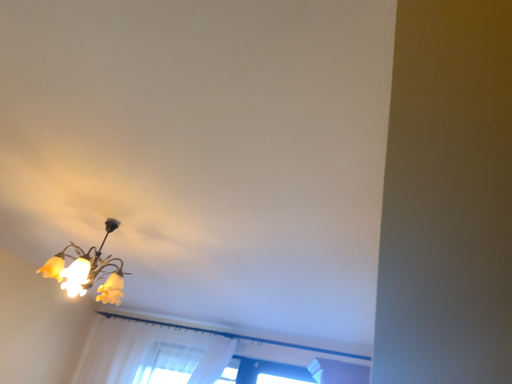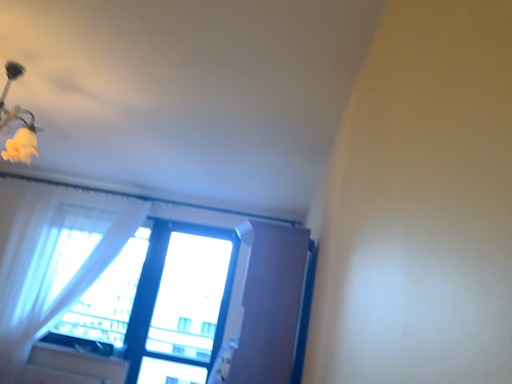
Question: Which way did the camera rotate in the video?

Choices:
 (A) rotated right
 (B) rotated left

Answer: (A)